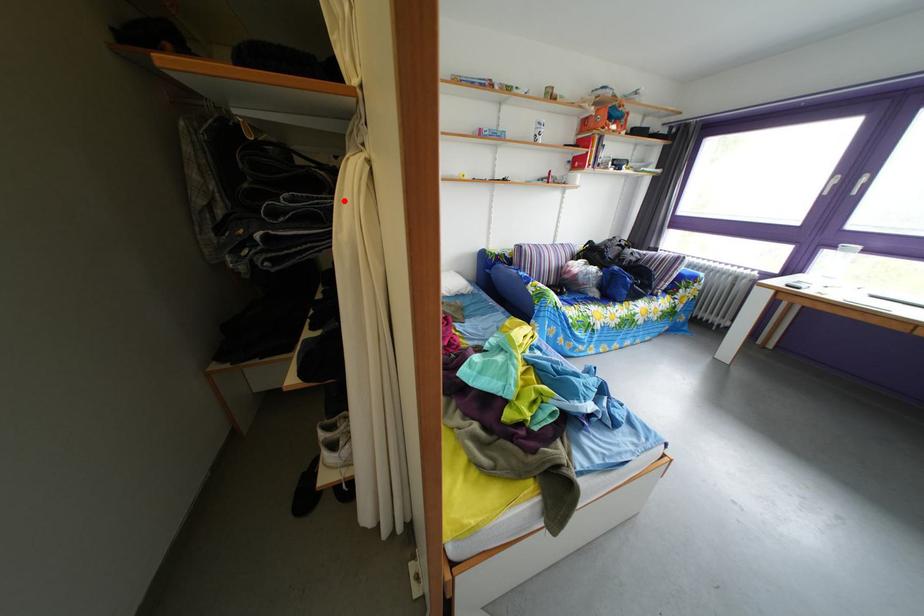
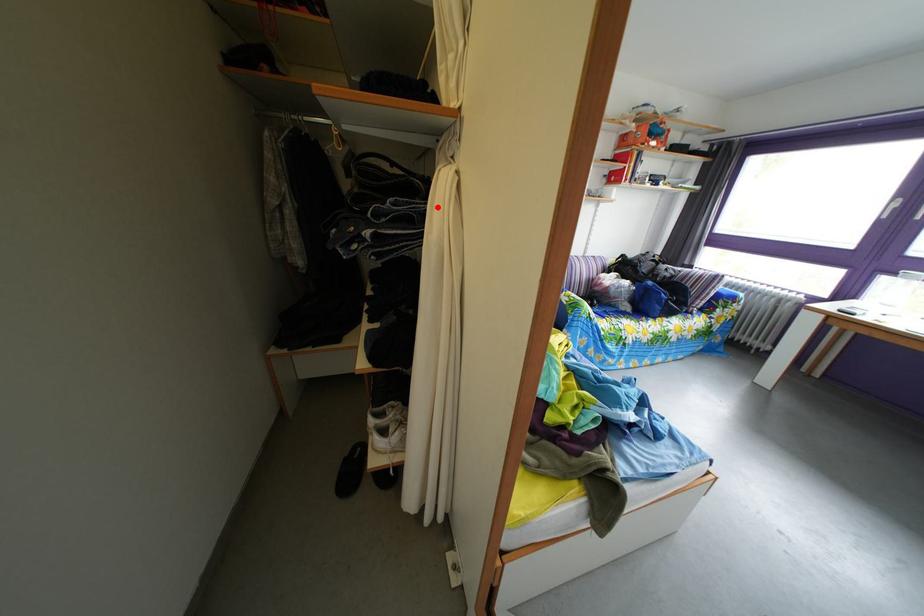
I am providing you with two images of the same scene from different viewpoints. A red point is marked on the first image and another point is marked on the second image. Is the red point in image1 aligned with the point shown in image2?

Yes